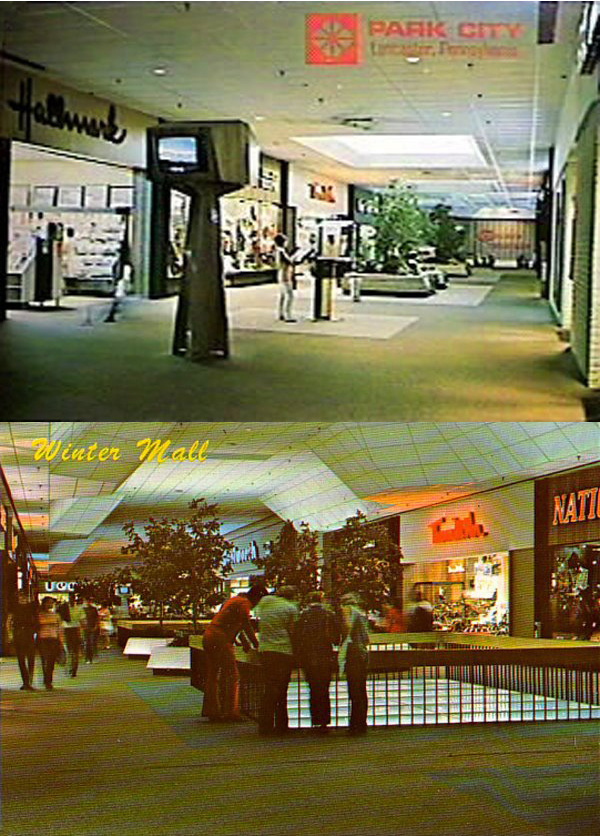
At what (x,y) coordinates should I click in order to perform the action: click on ceiling. Please return your answer as a coordinate pair (x, y). Looking at the image, I should click on (184, 490), (241, 59).